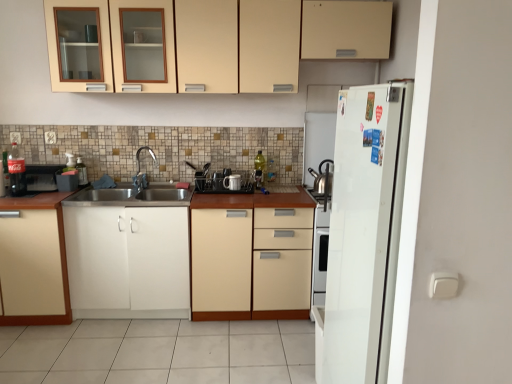
Question: Considering the relative sizes of silver metallic tea pot at right and beige wood cabinet at center, the first cabinetry positioned from the right, in the image provided, is silver metallic tea pot at right taller than beige wood cabinet at center, the first cabinetry positioned from the right,?

Choices:
 (A) yes
 (B) no

Answer: (B)

Question: Considering the relative sizes of silver metallic tea pot at right and beige wood cabinet at center, marked as the fourth cabinetry in a left-to-right arrangement, in the image provided, is silver metallic tea pot at right wider than beige wood cabinet at center, marked as the fourth cabinetry in a left-to-right arrangement,?

Choices:
 (A) yes
 (B) no

Answer: (B)

Question: Is silver metallic tea pot at right positioned in front of beige wood cabinet at center, the first cabinetry positioned from the right?

Choices:
 (A) yes
 (B) no

Answer: (B)

Question: Are silver metallic tea pot at right and beige wood cabinet at center, the first cabinetry positioned from the right, making contact?

Choices:
 (A) yes
 (B) no

Answer: (B)

Question: From the image's perspective, is silver metallic tea pot at right below beige wood cabinet at center, the first cabinetry positioned from the right?

Choices:
 (A) yes
 (B) no

Answer: (B)

Question: In terms of height, does silver metallic tea pot at right look taller or shorter compared to white glossy kettle at right, which appears as the 4th appliance when viewed from the left?

Choices:
 (A) tall
 (B) short

Answer: (B)

Question: Is silver metallic tea pot at right inside the boundaries of white glossy kettle at right, which appears as the 4th appliance when viewed from the left, or outside?

Choices:
 (A) inside
 (B) outside

Answer: (B)

Question: Is point (315, 182) closer or farther from the camera than point (330, 112)?

Choices:
 (A) closer
 (B) farther

Answer: (B)

Question: From the image's perspective, is silver metallic tea pot at right above or below white glossy kettle at right, which appears as the 4th appliance when viewed from the left?

Choices:
 (A) above
 (B) below

Answer: (B)

Question: In terms of width, does white matte refrigerator at right look wider or thinner when compared to white plastic electric outlet at lower left, the first electric outlet when ordered from left to right?

Choices:
 (A) wide
 (B) thin

Answer: (A)

Question: From the image's perspective, is white matte refrigerator at right positioned above or below white plastic electric outlet at lower left, the first electric outlet when ordered from left to right?

Choices:
 (A) below
 (B) above

Answer: (A)

Question: Is white matte refrigerator at right inside or outside of white plastic electric outlet at lower left, the first electric outlet when ordered from left to right?

Choices:
 (A) inside
 (B) outside

Answer: (B)

Question: From a real-world perspective, is white matte refrigerator at right above or below white plastic electric outlet at lower left, which is the second electric outlet from right to left?

Choices:
 (A) below
 (B) above

Answer: (A)

Question: Is translucent glass bottle at center, the 1th bottle positioned from the right, wider or thinner than matte cream cabinet at upper center, the third cabinetry from the left?

Choices:
 (A) thin
 (B) wide

Answer: (A)

Question: From the image's perspective, relative to matte cream cabinet at upper center, the third cabinetry from the left, is translucent glass bottle at center, the 1th bottle positioned from the right, above or below?

Choices:
 (A) above
 (B) below

Answer: (B)